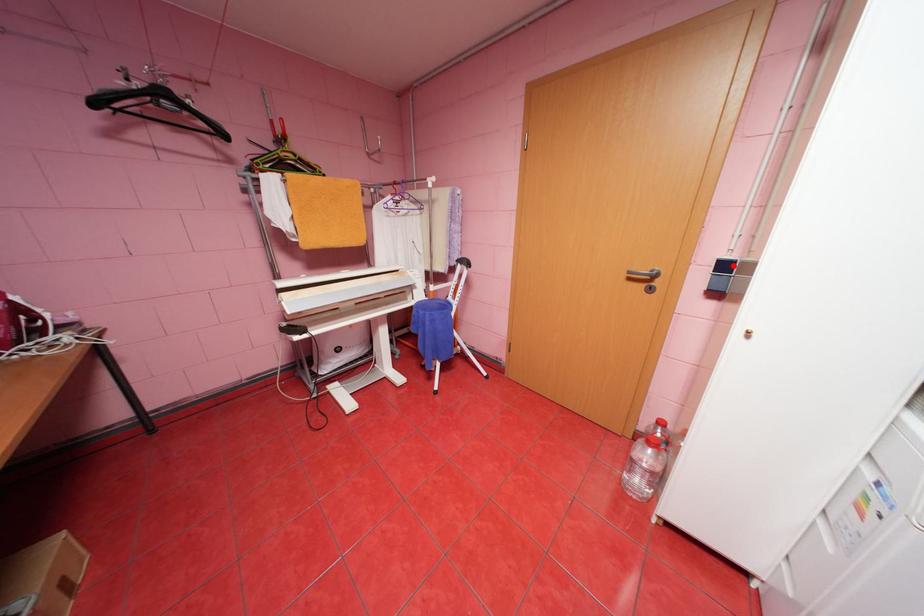
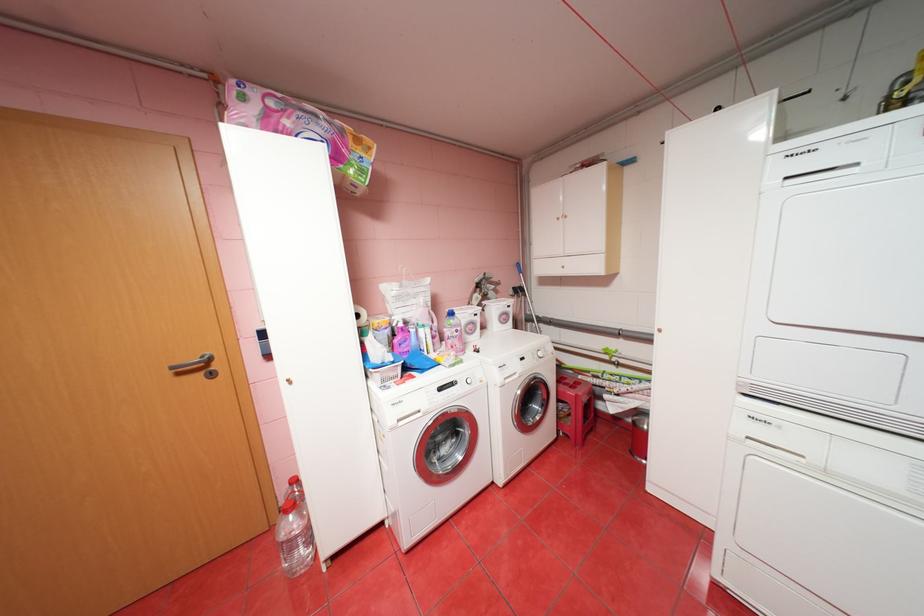
Question: I am providing you with two images of the same scene from different viewpoints. A red point is marked on the first image. Is the red point's position out of view in image 2?

Choices:
 (A) Yes
 (B) No

Answer: (A)